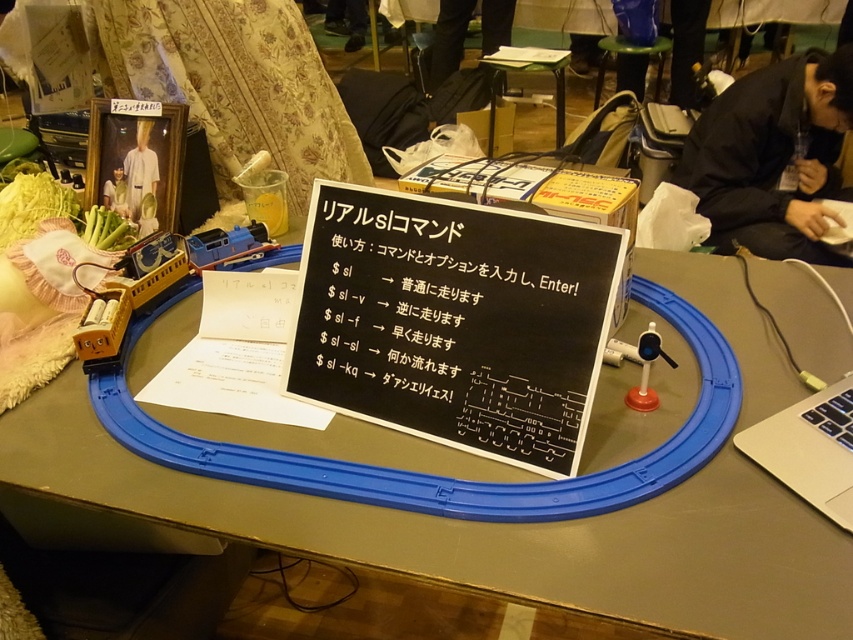
You are standing at the point with coordinates point (155, 179) and want to walk to the point with coordinates point (664, 516). Which direction should you face to move towards your destination?

You should face the direction towards point (664, 516), which is in front of point (155, 179), so facing towards it would be the correct direction.

You are setting up a model train display and need to ensure the command sign is visible to visitors. The black paper at center and white fabric at center are both on the table. Which object should you place higher to make the signboard more visible?

The white fabric at center should be placed higher than the black paper at center because the black paper at center is located below white fabric at center, so raising the white fabric will ensure the signboard remains visible over the black paper at center.

You are a visitor at a model train exhibit and notice the blue plastic track at center and the white fabric at center. Which object is located below the other?

The blue plastic track at center is positioned under the white fabric at center, so the blue plastic track is below the white fabric.